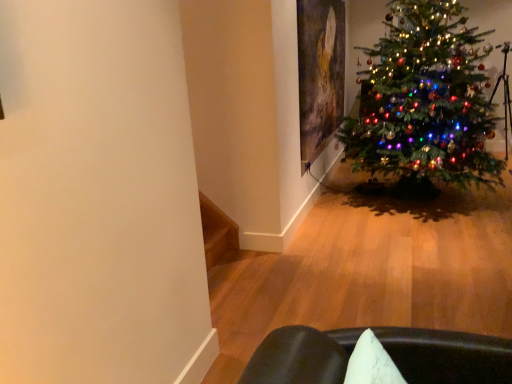
Question: Is point (342, 82) positioned closer to the camera than point (479, 92)?

Choices:
 (A) farther
 (B) closer

Answer: (A)

Question: From the image's perspective, is oil painting at upper right located above or below multicolored lights christmas tree at right?

Choices:
 (A) above
 (B) below

Answer: (A)

Question: Visually, is oil painting at upper right positioned to the left or to the right of multicolored lights christmas tree at right?

Choices:
 (A) right
 (B) left

Answer: (B)

Question: Relative to oil painting at upper right, is multicolored lights christmas tree at right in front or behind?

Choices:
 (A) behind
 (B) front

Answer: (B)

Question: Considering the positions of multicolored lights christmas tree at right and oil painting at upper right in the image, is multicolored lights christmas tree at right wider or thinner than oil painting at upper right?

Choices:
 (A) thin
 (B) wide

Answer: (B)

Question: Considering the positions of multicolored lights christmas tree at right and oil painting at upper right in the image, is multicolored lights christmas tree at right taller or shorter than oil painting at upper right?

Choices:
 (A) tall
 (B) short

Answer: (A)

Question: Does point (392, 52) appear closer or farther from the camera than point (309, 74)?

Choices:
 (A) closer
 (B) farther

Answer: (B)